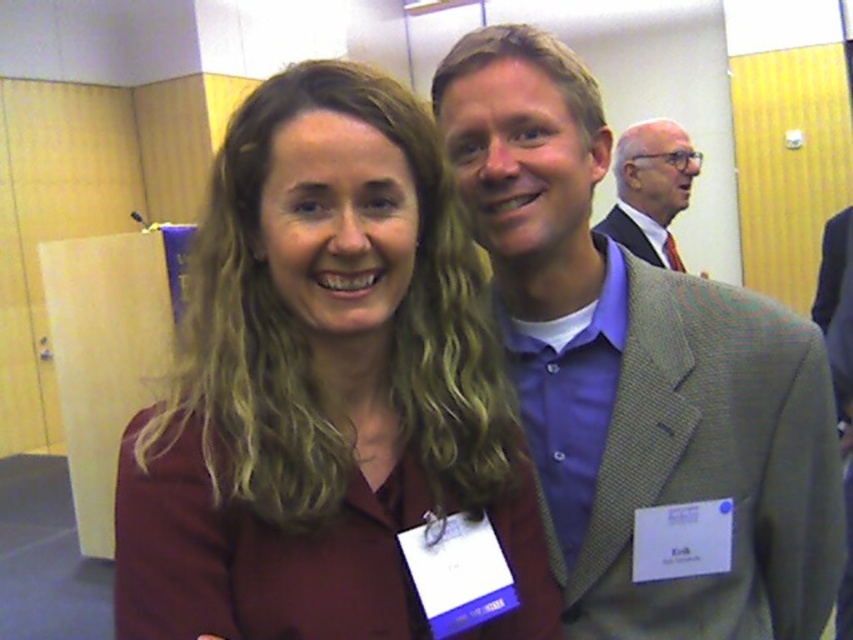
You are a photographer at a conference and need to adjust the camera angle to ensure both the light brown suit at upper right and the light brown textured suit at upper right are fully visible in the photo. Which suit should you focus on first to ensure its full height is captured?

The light brown suit at upper right has a greater height compared to the light brown textured suit at upper right, so you should focus on capturing the light brown suit at upper right first to ensure its full height is visible.

You are a photographer at a conference and need to ensure that both the light brown suit at upper right and the light brown textured suit at upper right are visible in your photo. Based on their positions, which suit is covering part of the other?

The light brown suit at upper right is positioned over the light brown textured suit at upper right, so the light brown suit at upper right is covering part of the light brown textured suit at upper right.